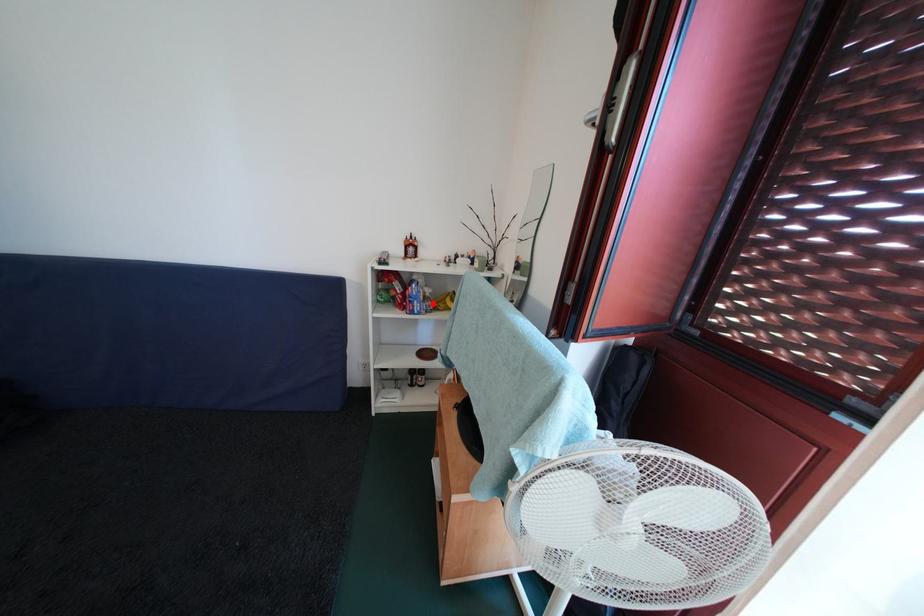
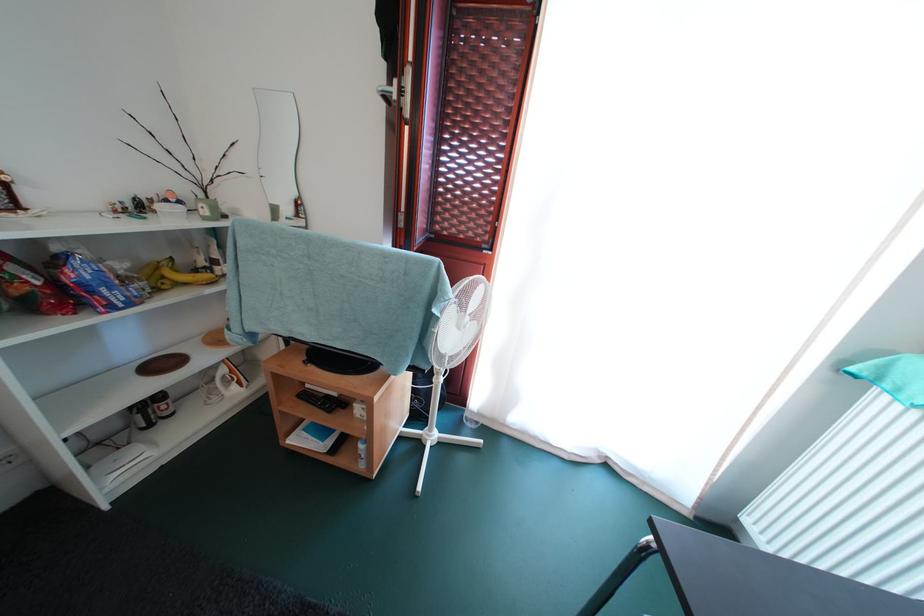
In the second image, find the point that corresponds to the highlighted location in the first image.

(131, 285)